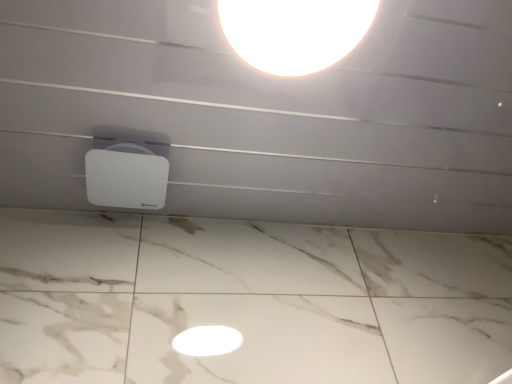
Question: From the image's perspective, is white glossy lampshade at upper center, the 2th lamp viewed from the back, located above or below white matte speaker at center, which appears as the 1th lamp when viewed from the left?

Choices:
 (A) above
 (B) below

Answer: (A)

Question: From a real-world perspective, relative to white matte speaker at center, the 1th lamp ordered from the bottom, is white glossy lampshade at upper center, the second lamp from the bottom, vertically above or below?

Choices:
 (A) below
 (B) above

Answer: (A)

Question: Would you say white glossy lampshade at upper center, the 2th lamp viewed from the back, is to the left or to the right of white matte speaker at center, arranged as the 2th lamp when viewed from the front, in the picture?

Choices:
 (A) right
 (B) left

Answer: (A)

Question: Is point (123, 152) closer or farther from the camera than point (365, 33)?

Choices:
 (A) farther
 (B) closer

Answer: (A)

Question: In the image, is white matte speaker at center, marked as the 1th lamp in a back-to-front arrangement, positioned in front of or behind white glossy lampshade at upper center, the second lamp from the bottom?

Choices:
 (A) behind
 (B) front

Answer: (A)

Question: Considering the positions of white matte speaker at center, arranged as the 2th lamp when viewed from the front, and white glossy lampshade at upper center, the second lamp from the bottom, in the image, is white matte speaker at center, arranged as the 2th lamp when viewed from the front, taller or shorter than white glossy lampshade at upper center, the second lamp from the bottom,?

Choices:
 (A) tall
 (B) short

Answer: (B)

Question: From the image's perspective, is white matte speaker at center, the second lamp from the right, above or below white glossy lampshade at upper center, placed as the 2th lamp when sorted from left to right?

Choices:
 (A) below
 (B) above

Answer: (A)